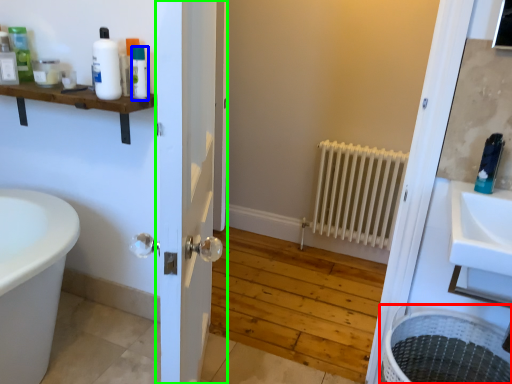
Question: Considering the real-world distances, which object is farthest from laundry basket (highlighted by a red box)? toiletry (highlighted by a blue box) or door (highlighted by a green box)?

Choices:
 (A) toiletry
 (B) door

Answer: (A)